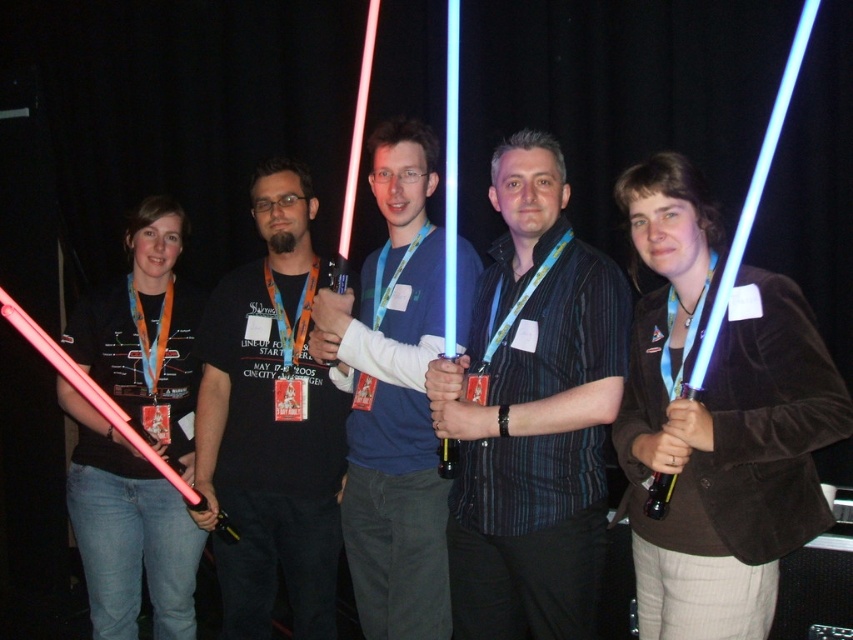
Between shiny blue light saber at center and matte black t-shirt at center, which one is positioned higher?

shiny blue light saber at center

Which is below, shiny blue light saber at center or matte black t-shirt at center?

matte black t-shirt at center

Describe the element at coordinates (532, 413) in the screenshot. I see `shiny blue light saber at center` at that location.

Locate an element on the screen. shiny blue light saber at center is located at coordinates (532, 413).

Does matte black t-shirt at center appear under matte plastic lightsaber at center?

→ Indeed, matte black t-shirt at center is positioned under matte plastic lightsaber at center.

The image size is (853, 640). I want to click on matte black t-shirt at center, so click(271, 422).

Image resolution: width=853 pixels, height=640 pixels. I want to click on matte black t-shirt at center, so (271, 422).

Can you confirm if shiny blue light saber at center is positioned to the left of matte plastic lightsaber at center?

No, shiny blue light saber at center is not to the left of matte plastic lightsaber at center.

Find the location of a particular element. Image resolution: width=853 pixels, height=640 pixels. shiny blue light saber at center is located at coordinates (532, 413).